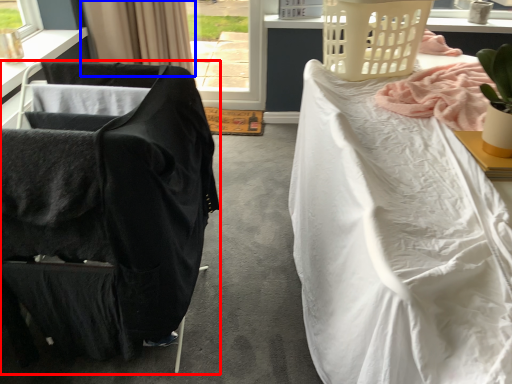
Question: Which object is closer to the camera taking this photo, chair (highlighted by a red box) or curtain (highlighted by a blue box)?

Choices:
 (A) chair
 (B) curtain

Answer: (A)